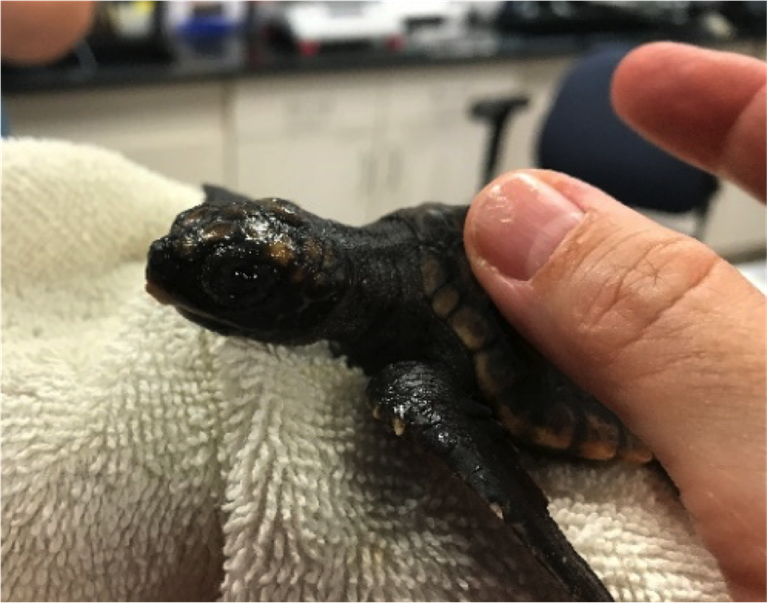
Where is `towel`? Image resolution: width=768 pixels, height=603 pixels. towel is located at coordinates (214, 418).